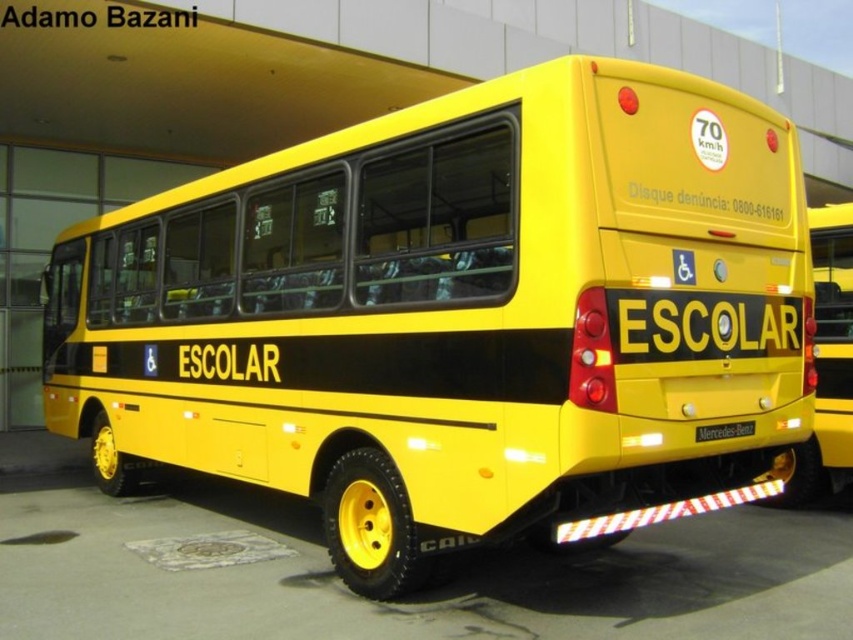
Question: Can you confirm if yellow matte bus at right is positioned to the right of yellow matte license plate at rear?

Choices:
 (A) no
 (B) yes

Answer: (B)

Question: Can you confirm if yellow matte bus at right is bigger than yellow matte license plate at rear?

Choices:
 (A) yes
 (B) no

Answer: (A)

Question: Among these objects, which one is nearest to the camera?

Choices:
 (A) yellow matte license plate at rear
 (B) yellow matte bus at right

Answer: (A)

Question: Is yellow matte bus at right positioned in front of yellow matte license plate at rear?

Choices:
 (A) no
 (B) yes

Answer: (A)

Question: Which object appears closest to the camera in this image?

Choices:
 (A) yellow matte bus at right
 (B) yellow matte license plate at rear

Answer: (B)